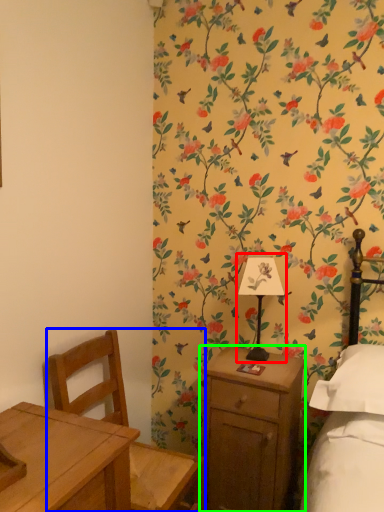
Question: Based on their relative distances, which object is farther from bedside lamp (highlighted by a red box)? Choose from chair (highlighted by a blue box) and nightstand (highlighted by a green box).

Choices:
 (A) chair
 (B) nightstand

Answer: (A)